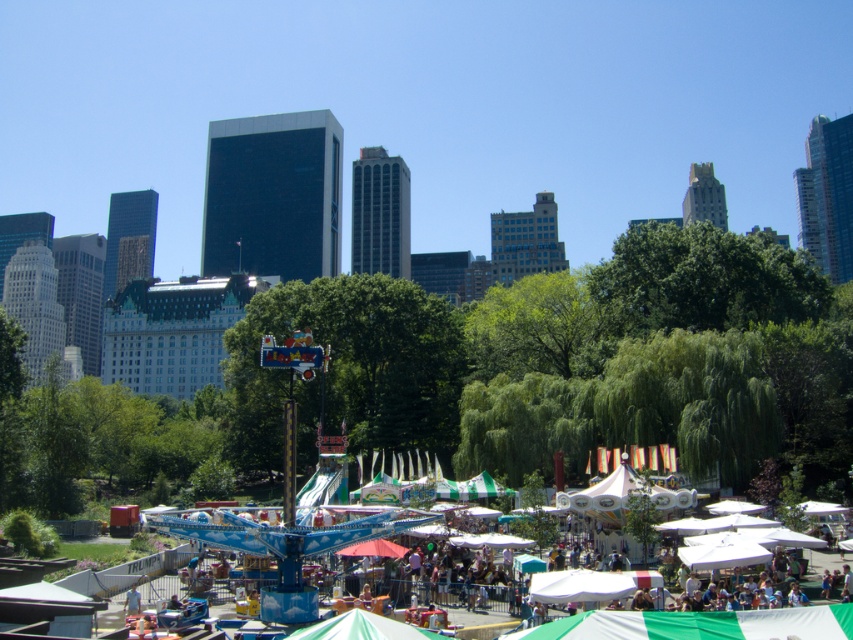
Is green fabric canopy at lower center taller than green fabric canopy at center?

No.

Between point (793, 632) and point (312, 634), which one is positioned in front?

Point (793, 632) is in front.

You are a GUI agent. You are given a task and a screenshot of the screen. Output one action in this format:
    pyautogui.click(x=<x>, y=<y>)
    Task: Click on the green fabric canopy at lower center
    The image size is (853, 640).
    Given the screenshot: What is the action you would take?
    pyautogui.click(x=699, y=625)